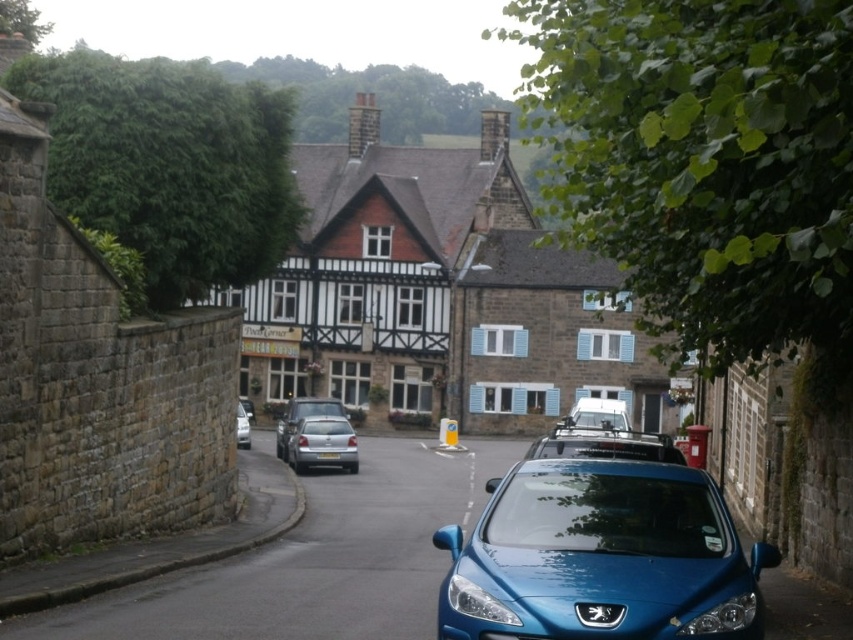
You are a delivery driver who needs to park your truck between the white matte van at center and the silver metallic hatchback at center. Given that your truck is 5 meters long, can you fit it in the space between them?

The white matte van at center is bigger than the silver metallic hatchback at center, but the exact distance between them isn not provided. Without knowing the space between the two vehicles, it is impossible to determine if the truck will fit.

You are a pedestrian standing at the edge of the street. You see a metallic blue car at lower center and a white matte van at center. Which vehicle is closer to you?

The metallic blue car at lower center is closer to you because it is located above the white matte van at center, indicating it is positioned higher up in the image and thus nearer to the observer.

You are a delivery driver who needs to park your vehicle in this street. You have two options here, the white matte van at center and the silver metallic hatchback at center. Considering the height restrictions in this area, which vehicle would be more suitable to avoid hitting the low hanging decorative wooden beams above the windows of the traditional stone building?

The silver metallic hatchback at center is more suitable because it is shorter than the white matte van at center, reducing the risk of hitting the low hanging decorative wooden beams above the windows.